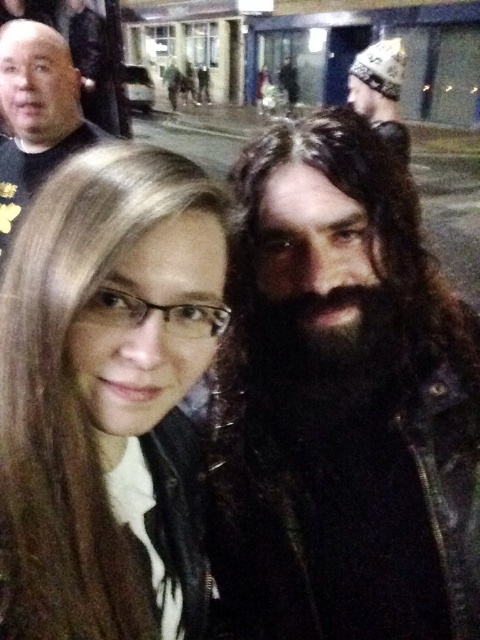
You are a photographer standing 2 feet away from the camera. You want to take a photo of the matte black jacket at center. Can you step back to ensure the jacket is in focus without moving the jacket?

The matte black jacket at center is currently 18.29 inches from the camera. Since you are standing 2 feet away, which is equivalent to 24 inches, you can step back slightly to increase the distance between yourself and the camera. This adjustment would help ensure the jacket remains in focus while maintaining a clear composition.

You are a photographer setting up a shoot in this urban night scene. You need to position a light stand between the dark brown leather jacket at right and the matte black jacket at center. Which jacket should the light stand be placed closer to if you want it to be closer to the taller jacket?

The light stand should be placed closer to the dark brown leather jacket at right because it is taller than the matte black jacket at center according to the description.

You are a photographer trying to capture a clear shot of both the matte black jacket at center and the black leather jacket at upper left. Based on their positions, which jacket is located to the right of the other?

The matte black jacket at center is positioned on the right side of the black leather jacket at upper left.